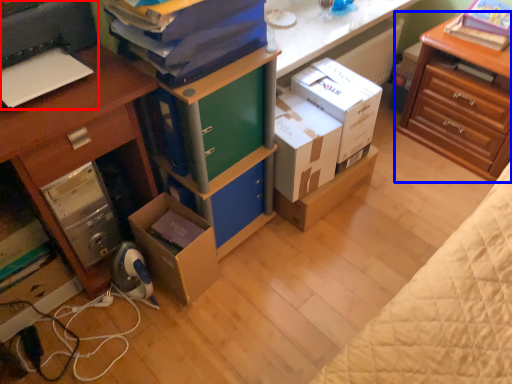
Question: Which point is closer to the camera, printer (highlighted by a red box) or nightstand (highlighted by a blue box)?

Choices:
 (A) printer
 (B) nightstand

Answer: (A)